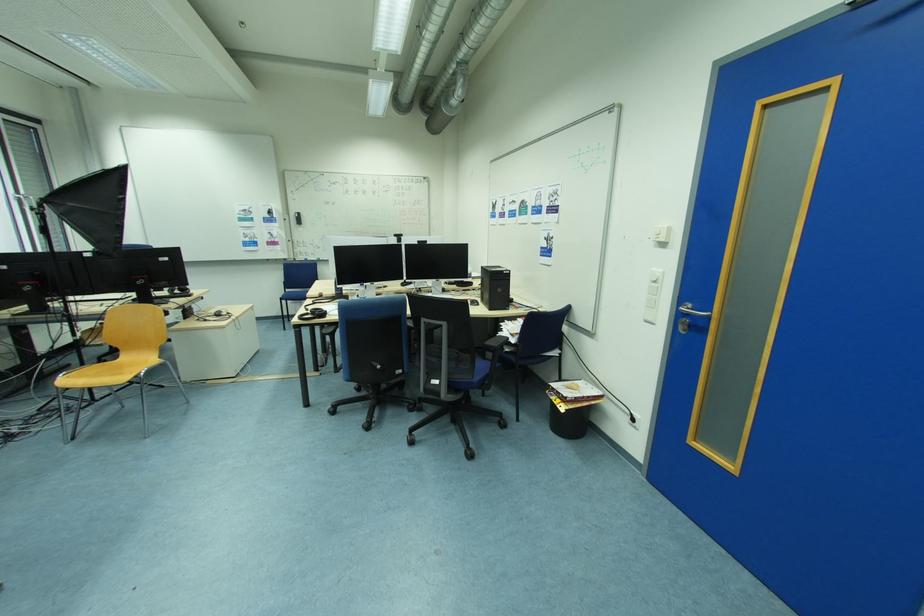
At what (x,y) coordinates should I click in order to perform the action: click on black trash can. Please return your answer as a coordinate pair (x, y). This screenshot has height=616, width=924. Looking at the image, I should click on (567, 418).